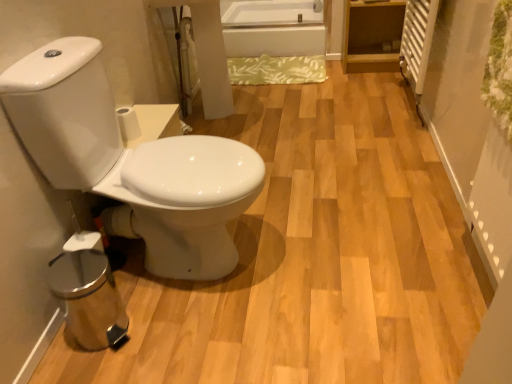
Question: From the image's perspective, does white glossy toilet at left appear lower than white glossy bathtub at upper center?

Choices:
 (A) yes
 (B) no

Answer: (A)

Question: Does white glossy toilet at left appear on the right side of white glossy bathtub at upper center?

Choices:
 (A) yes
 (B) no

Answer: (B)

Question: Is white glossy toilet at left in contact with white glossy bathtub at upper center?

Choices:
 (A) no
 (B) yes

Answer: (A)

Question: Would you say white glossy bathtub at upper center is part of white glossy toilet at left's contents?

Choices:
 (A) yes
 (B) no

Answer: (B)

Question: Does white glossy toilet at left have a greater width compared to white glossy bathtub at upper center?

Choices:
 (A) yes
 (B) no

Answer: (B)

Question: Can we say white glossy toilet at left lies outside white glossy bathtub at upper center?

Choices:
 (A) no
 (B) yes

Answer: (B)

Question: Is white matte toilet paper at center facing away from white glossy bathtub at upper center?

Choices:
 (A) no
 (B) yes

Answer: (A)

Question: Is white matte toilet paper at center behind white glossy bathtub at upper center?

Choices:
 (A) no
 (B) yes

Answer: (A)

Question: Would you say white matte toilet paper at center is outside white glossy bathtub at upper center?

Choices:
 (A) yes
 (B) no

Answer: (A)

Question: Is the position of white matte toilet paper at center less distant than that of white glossy bathtub at upper center?

Choices:
 (A) yes
 (B) no

Answer: (A)

Question: Is white matte toilet paper at center not close to white glossy bathtub at upper center?

Choices:
 (A) no
 (B) yes

Answer: (B)

Question: Does white matte toilet paper at center contain white glossy bathtub at upper center?

Choices:
 (A) no
 (B) yes

Answer: (A)

Question: Is white glossy toilet at left placed right next to white matte toilet paper at center?

Choices:
 (A) no
 (B) yes

Answer: (A)